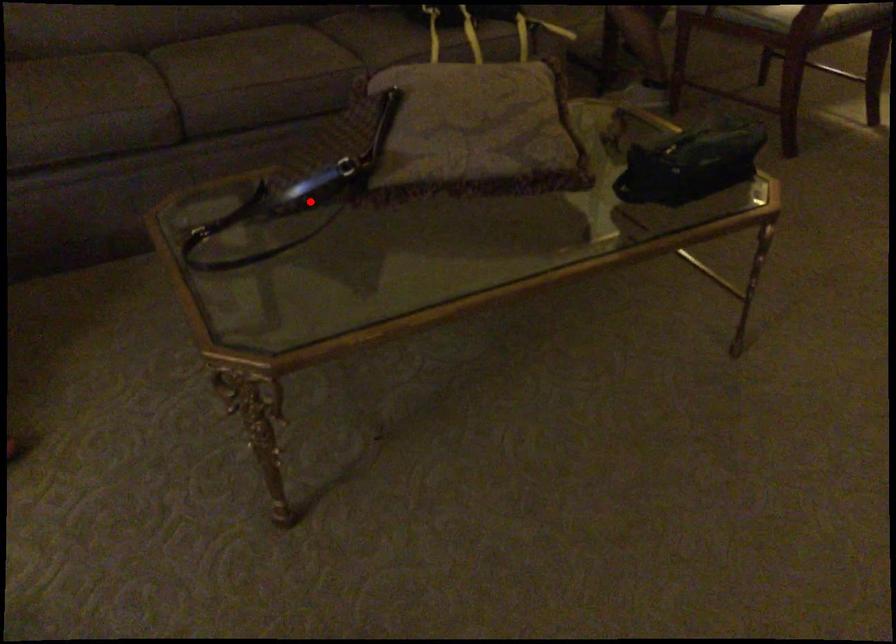
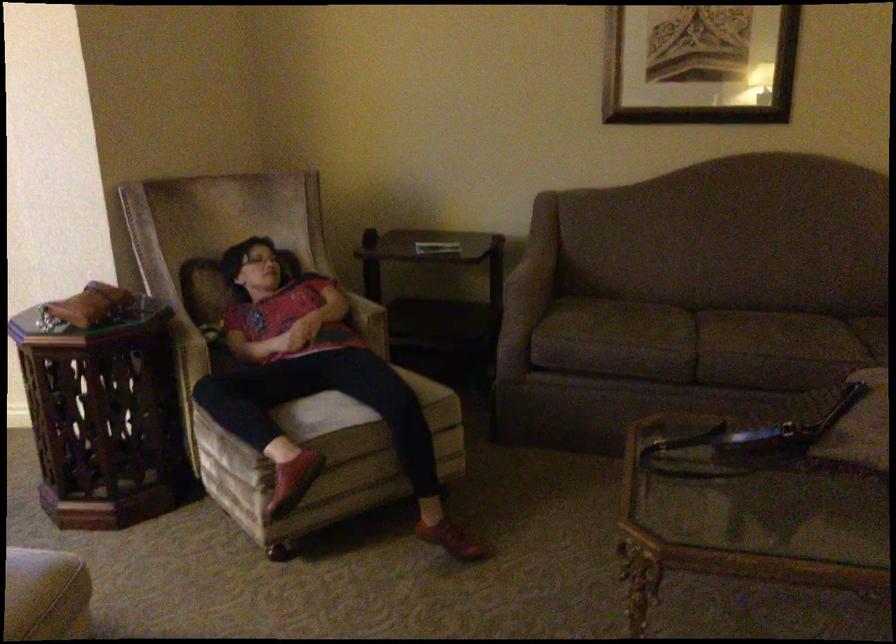
Question: I am providing you with two images of the same scene from different viewpoints. In image1, a red point is highlighted. Considering the same 3D point in image2, which of the following is correct?

Choices:
 (A) It is closer
 (B) It is farther

Answer: (B)